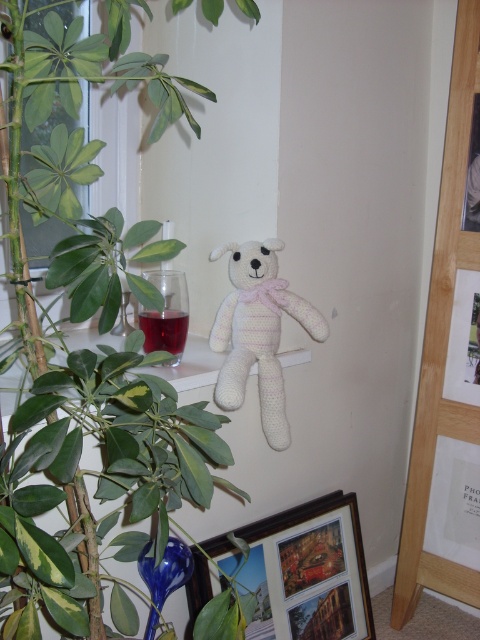
You are arranging a shelf in the cozy indoor corner and need to place both the green leafy plant at upper left and the wooden framed photo at lower center. Based on their current positions, which object is higher up?

The green leafy plant at upper left is located above the wooden framed photo at lower center, so it is higher up.

Based on the photo, you are a cat sitting on the windowsill where the white knitted bear at center is placed. You want to jump to the green leafy plant at upper left. Can you reach it without moving from your current position?

The green leafy plant at upper left is in front of the white knitted bear at center, so from the windowsill where the bear is, the plant is closer. Since the cat is on the windowsill with the bear, the plant is within reach without needing to move.

You are organizing a small shelf in the cozy indoor corner and need to place both the wooden framed photo at lower center and the white knitted bear at center. Based on their positions, which object should you place higher up to maintain the current arrangement?

Answer: You should place the white knitted bear at center higher up since the wooden framed photo at lower center is located below it in the current arrangement.